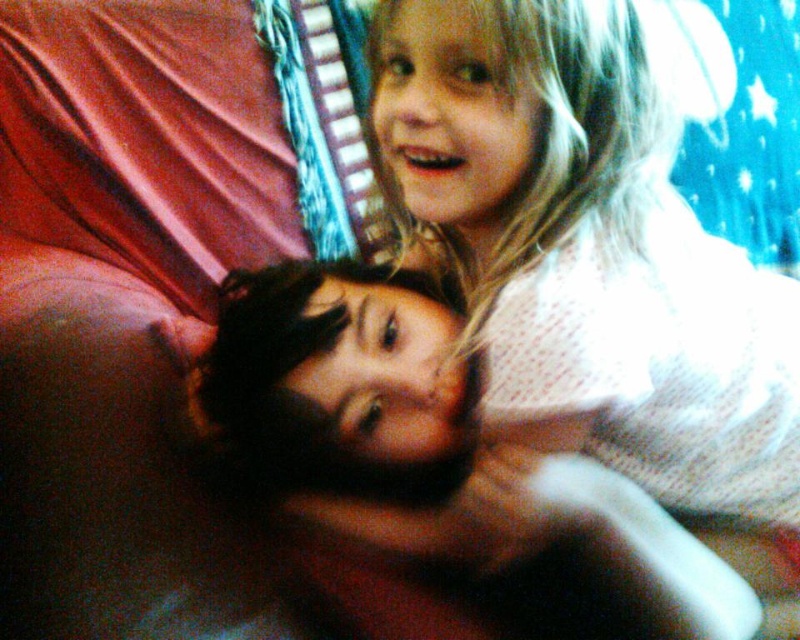
Who is more forward, (733, 442) or (684, 573)?

Positioned in front is point (684, 573).

Who is higher up, white dotted shirt at upper center or smooth skin face at center?

Positioned higher is white dotted shirt at upper center.

Between point (674, 17) and point (332, 436), which one is positioned in front?

Point (332, 436) is in front.

At what (x,y) coordinates should I click in order to perform the action: click on white dotted shirt at upper center. Please return your answer as a coordinate pair (x, y). Looking at the image, I should click on (592, 241).